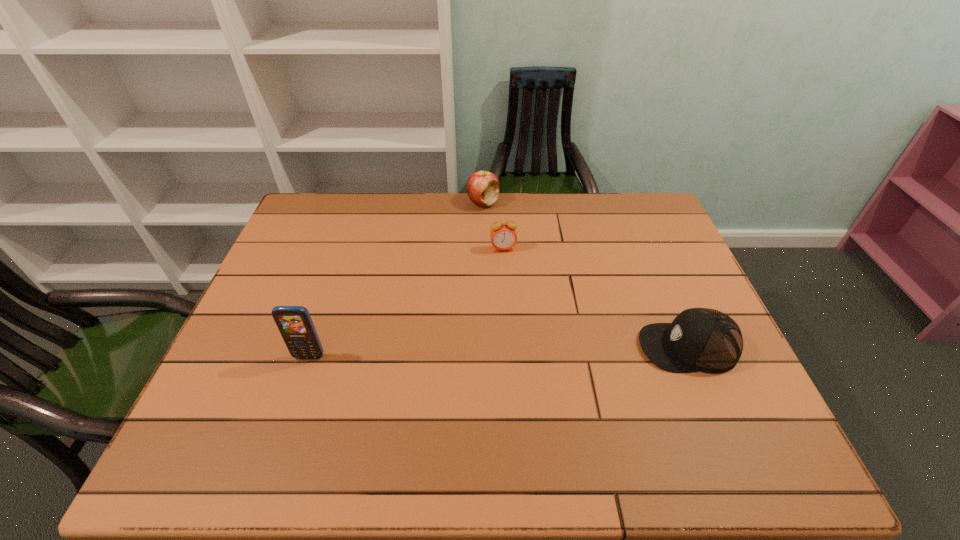
This screenshot has width=960, height=540. What are the coordinates of `free location at the left edge` in the screenshot? It's located at (318, 274).

You are a GUI agent. You are given a task and a screenshot of the screen. Output one action in this format:
    pyautogui.click(x=<x>, y=<y>)
    Task: Click on the vacant area at the right edge
    Image resolution: width=960 pixels, height=540 pixels.
    Given the screenshot: What is the action you would take?
    pyautogui.click(x=649, y=288)

At what (x,y) coordinates should I click in order to perform the action: click on free space at the near left corner of the desktop. Please return your answer as a coordinate pair (x, y). The width and height of the screenshot is (960, 540). Looking at the image, I should click on (219, 392).

Locate an element on the screen. free point at the far right corner is located at coordinates (640, 234).

This screenshot has width=960, height=540. Identify the location of unoccupied position between the rightmost object and the tallest object. (498, 352).

Locate an element on the screen. Image resolution: width=960 pixels, height=540 pixels. unoccupied area between the leftmost object and the alarm clock is located at coordinates (406, 303).

Find the location of a particular element. This screenshot has width=960, height=540. vacant area that lies between the second farthest object and the cellular telephone is located at coordinates (406, 303).

At what (x,y) coordinates should I click in order to perform the action: click on empty location between the cap and the cellular telephone. Please return your answer as a coordinate pair (x, y). Looking at the image, I should click on click(x=498, y=352).

The width and height of the screenshot is (960, 540). In order to click on vacant point located between the leftmost object and the rightmost object in this screenshot , I will do `click(498, 352)`.

Where is `free space between the tallest object and the alarm clock`? The width and height of the screenshot is (960, 540). free space between the tallest object and the alarm clock is located at coordinates (406, 303).